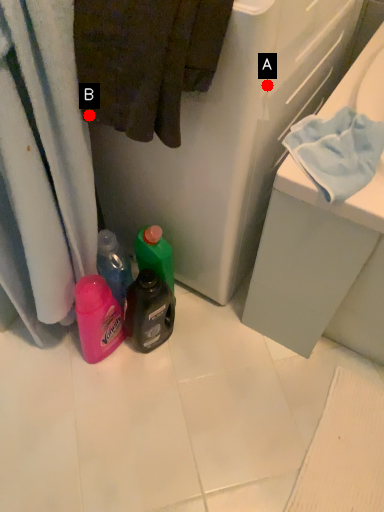
Question: Two points are circled on the image, labeled by A and B beside each circle. Which point is closer to the camera?

Choices:
 (A) A is closer
 (B) B is closer

Answer: (A)